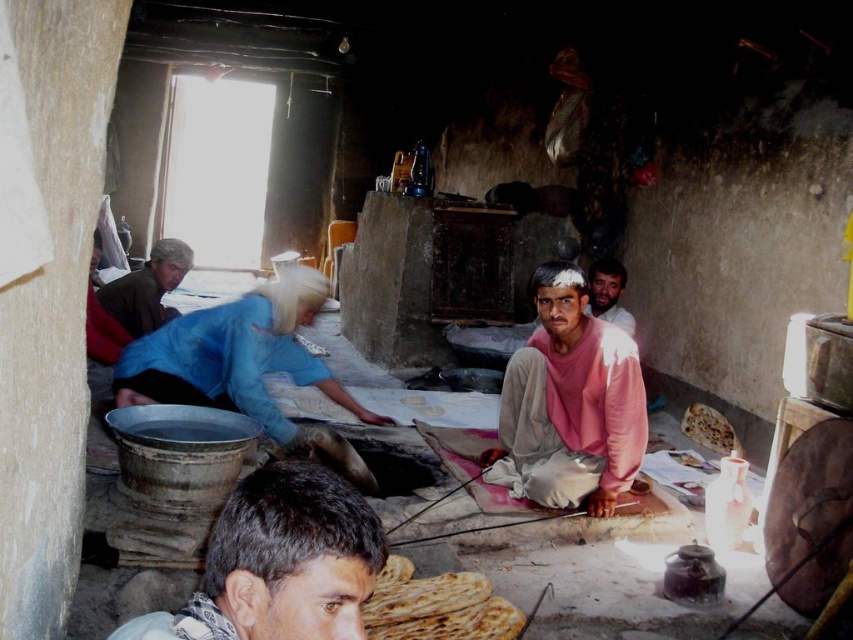
You are a photographer trying to capture the scene. You want to ensure that both the dark brown hair at lower center and the pink matte sweater at center are visible in your photo. Based on their heights, which object should you focus on first to ensure both are in frame?

The dark brown hair at lower center is not as tall as the pink matte sweater at center, so you should focus on the pink matte sweater at center first to ensure both are in frame.

You are standing in the rustic indoor setting and need to locate the dark brown hair at lower center. According to the coordinates provided, where exactly is this hair positioned?

The dark brown hair at lower center is located at point 0.880 on the x axis and 0.329 on the y axis.